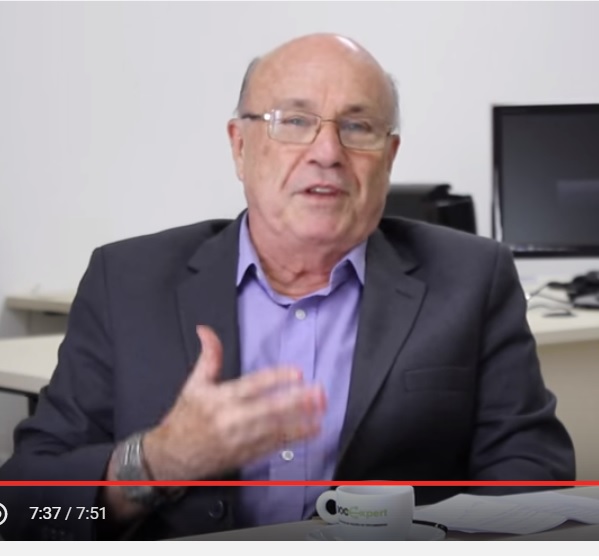
What are the coordinates of `monitor` in the screenshot? It's located at (547, 205).